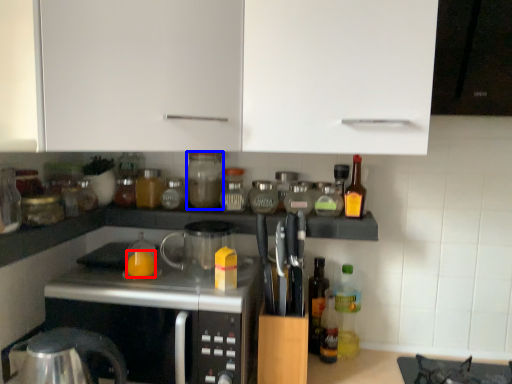
Question: Which object is closer to the camera taking this photo, orange juice (highlighted by a red box) or bottle (highlighted by a blue box)?

Choices:
 (A) orange juice
 (B) bottle

Answer: (A)